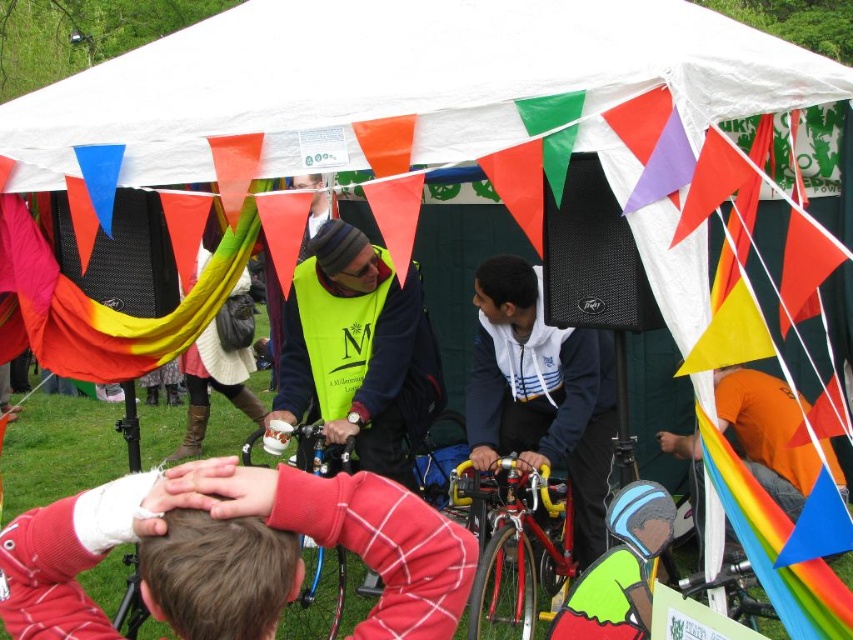
Question: Which point appears closest to the camera in this image?

Choices:
 (A) (497, 438)
 (B) (485, 573)
 (C) (263, 3)

Answer: (B)

Question: Does white fabric canopy at upper center have a larger size compared to red plaid shirt at center?

Choices:
 (A) yes
 (B) no

Answer: (A)

Question: Can you confirm if neon yellow vest at center is positioned above shiny red bicycle at center?

Choices:
 (A) no
 (B) yes

Answer: (B)

Question: Among these points, which one is farthest from the camera?

Choices:
 (A) [756, 67]
 (B) [515, 550]
 (C) [602, 500]

Answer: (C)

Question: Can you confirm if white fabric canopy at upper center is positioned to the left of white matte jacket at center?

Choices:
 (A) yes
 (B) no

Answer: (A)

Question: Estimate the real-world distances between objects in this image. Which object is farther from the white fabric canopy at upper center?

Choices:
 (A) shiny red bicycle at center
 (B) white matte jacket at center

Answer: (A)